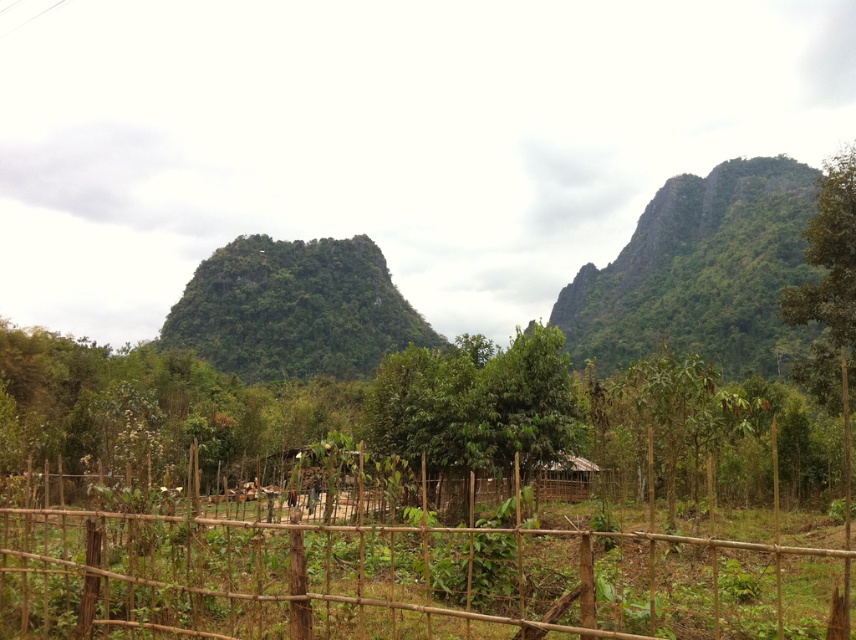
Question: Estimate the real-world distances between objects in this image. Which object is closer to the green leafy mountain at upper right?

Choices:
 (A) bamboo fence at center
 (B) brown wooden hut at center

Answer: (A)

Question: Is bamboo fence at center above brown wooden hut at center?

Choices:
 (A) no
 (B) yes

Answer: (B)

Question: Is bamboo fence at center bigger than green leafy mountain at upper right?

Choices:
 (A) no
 (B) yes

Answer: (A)

Question: Does bamboo fence at center have a greater width compared to green leafy mountain at upper right?

Choices:
 (A) yes
 (B) no

Answer: (B)

Question: Which object is the farthest from the brown wooden hut at center?

Choices:
 (A) bamboo fence at center
 (B) green leafy mountain at upper right

Answer: (B)

Question: Which point is farther to the camera?

Choices:
 (A) (736, 333)
 (B) (827, 632)
 (C) (568, 467)

Answer: (A)